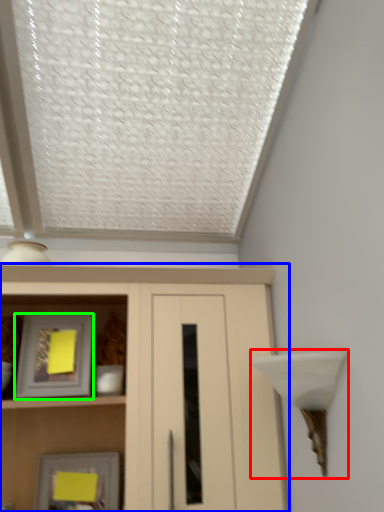
Question: Which is nearer to the table lamp (highlighted by a red box)? cupboard (highlighted by a blue box) or picture frame (highlighted by a green box).

Choices:
 (A) cupboard
 (B) picture frame

Answer: (A)